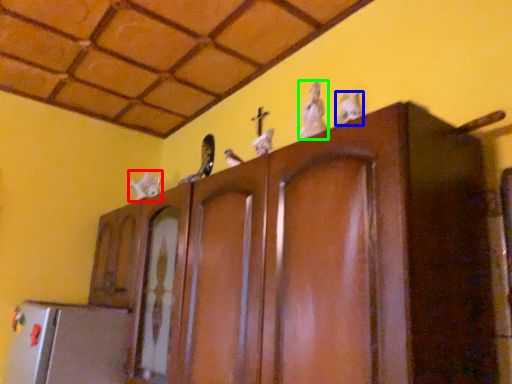
Question: Which is nearer to the animal (highlighted by a red box)? animal (highlighted by a blue box) or animal (highlighted by a green box).

Choices:
 (A) animal
 (B) animal

Answer: (B)